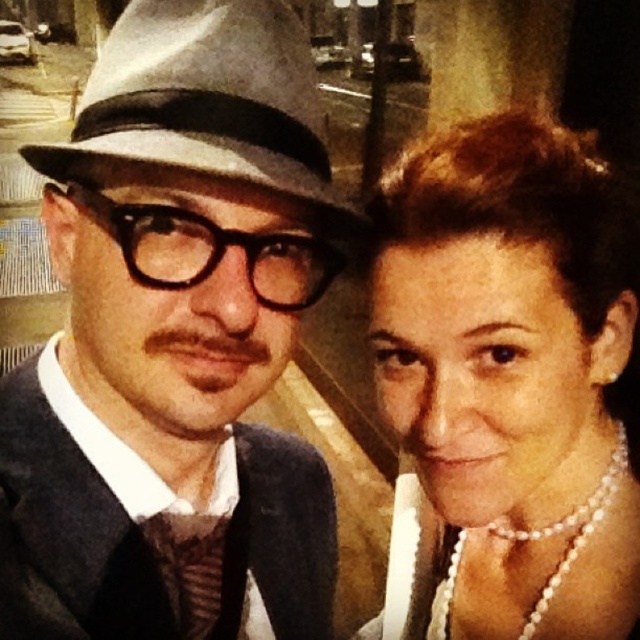
Where is the gray felt fedora at left located in the image?

The gray felt fedora at left is located at point [205,99] in the image.

You are a photographer trying to frame two subjects in a photo. The gray felt fedora at left and the striped fabric tie at center are visible in the shot. If you want to ensure both items are fully visible in the frame, which item requires more horizontal space due to its width?

The gray felt fedora at left might be wider than striped fabric tie at center, so it requires more horizontal space to ensure it is fully visible in the frame.

You are a photographer adjusting the camera settings for a portrait. The subjects are standing close together. You need to ensure that both the pearl necklace at upper right and the dark blue woolen suit at center are in focus. Given that the camera can only focus on objects within a 20 cm range, will both items be in focus?

The pearl necklace at upper right is 19.89 centimeters away from the dark blue woolen suit at center. Since the distance between them is within the 20 cm focus range, both items will be in focus.